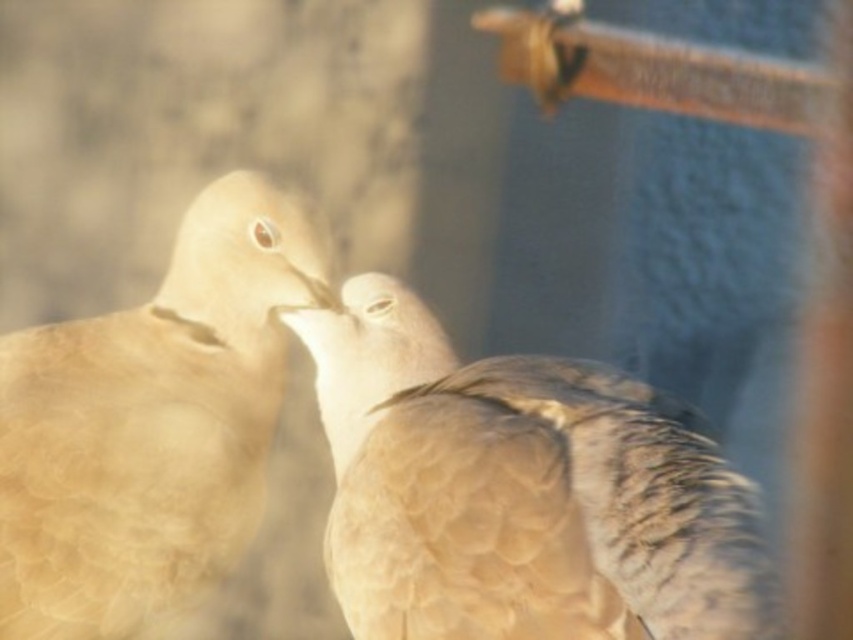
Question: Is brown feathered bird at center below matte beige bird at center?

Choices:
 (A) yes
 (B) no

Answer: (A)

Question: Can you confirm if brown feathered bird at center is wider than matte beige bird at center?

Choices:
 (A) no
 (B) yes

Answer: (B)

Question: Which point is closer to the camera?

Choices:
 (A) (283, 236)
 (B) (640, 445)

Answer: (B)

Question: Which point is closer to the camera?

Choices:
 (A) (723, 476)
 (B) (129, 545)

Answer: (A)

Question: Among these points, which one is farthest from the camera?

Choices:
 (A) (129, 525)
 (B) (408, 618)

Answer: (A)

Question: Is brown feathered bird at center positioned at the back of matte beige bird at center?

Choices:
 (A) no
 (B) yes

Answer: (A)